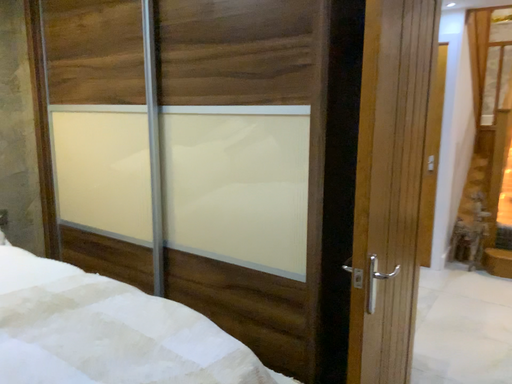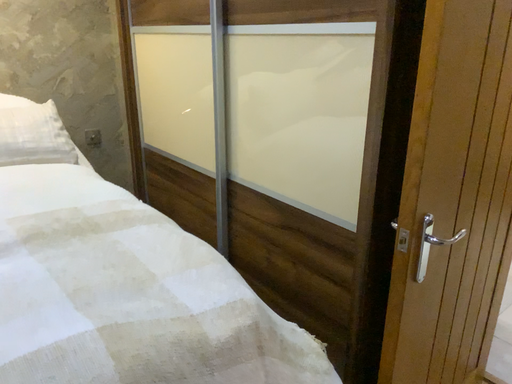
Question: Which way did the camera rotate in the video?

Choices:
 (A) rotated upward
 (B) rotated downward

Answer: (B)